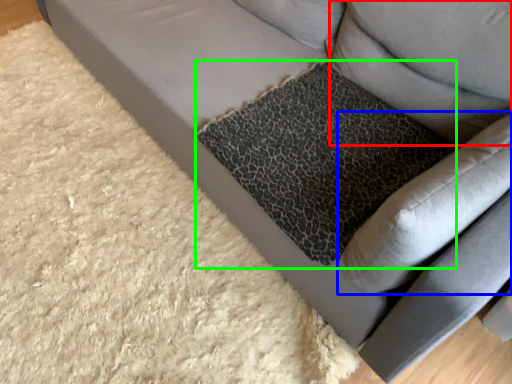
Question: Which object is positioned closest to pillow (highlighted by a red box)? Select from swivel chair (highlighted by a blue box) and cat bed (highlighted by a green box).

Choices:
 (A) swivel chair
 (B) cat bed

Answer: (B)